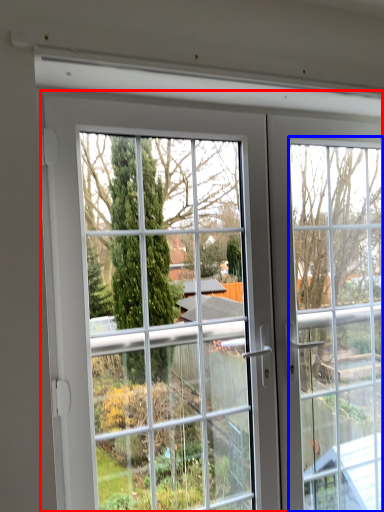
Question: Which point is closer to the camera, door (highlighted by a red box) or window frame (highlighted by a blue box)?

Choices:
 (A) door
 (B) window frame

Answer: (A)